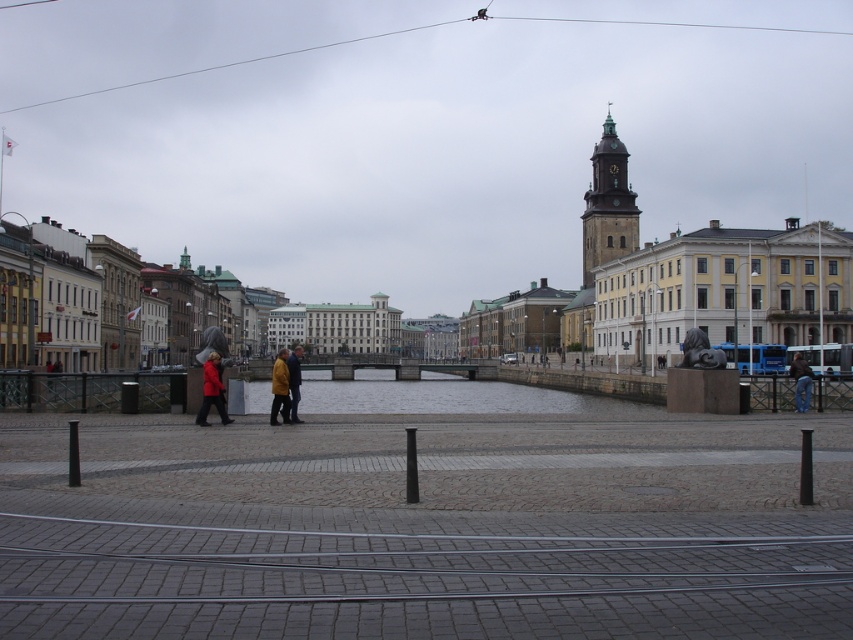
Does yellow matte jacket at center appear on the left side of matte red coat at center?

Correct, you'll find yellow matte jacket at center to the left of matte red coat at center.

In the scene shown: Which is below, yellow matte jacket at center or matte red coat at center?

Positioned lower is yellow matte jacket at center.

Who is more distant from viewer, (286,372) or (230,419)?

The point (230,419) is more distant.

You are a GUI agent. You are given a task and a screenshot of the screen. Output one action in this format:
    pyautogui.click(x=<x>, y=<y>)
    Task: Click on the yellow matte jacket at center
    The image size is (853, 640).
    Given the screenshot: What is the action you would take?
    click(281, 387)

Is clear water at center to the right of matte red coat at center from the viewer's perspective?

In fact, clear water at center is to the left of matte red coat at center.

Measure the distance between clear water at center and camera.

A distance of 38.43 meters exists between clear water at center and camera.

Between point (357, 392) and point (225, 422), which one is positioned behind?

The point (357, 392) is more distant.

Image resolution: width=853 pixels, height=640 pixels. I want to click on clear water at center, so click(432, 396).

Does matte red coat at center appear under yellow leather jacket at center?

Actually, matte red coat at center is above yellow leather jacket at center.

Where is `matte red coat at center`? This screenshot has height=640, width=853. matte red coat at center is located at coordinates (212, 390).

You are a GUI agent. You are given a task and a screenshot of the screen. Output one action in this format:
    pyautogui.click(x=<x>, y=<y>)
    Task: Click on the matte red coat at center
    
    Given the screenshot: What is the action you would take?
    pyautogui.click(x=212, y=390)